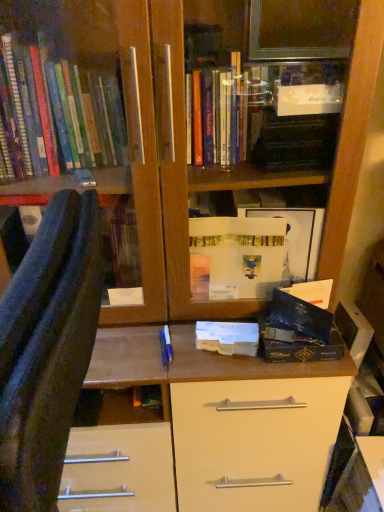
Question: Can you confirm if blue fabric chair at left is smaller than white matte paper at center?

Choices:
 (A) no
 (B) yes

Answer: (A)

Question: Does blue fabric chair at left have a lesser height compared to white matte paper at center?

Choices:
 (A) no
 (B) yes

Answer: (A)

Question: Considering the relative sizes of blue fabric chair at left and white matte paper at center in the image provided, is blue fabric chair at left bigger than white matte paper at center?

Choices:
 (A) no
 (B) yes

Answer: (B)

Question: Is blue fabric chair at left positioned before white matte paper at center?

Choices:
 (A) no
 (B) yes

Answer: (B)

Question: Would you say blue fabric chair at left is outside white matte paper at center?

Choices:
 (A) no
 (B) yes

Answer: (B)

Question: Does blue fabric chair at left have a lesser width compared to white matte paper at center?

Choices:
 (A) yes
 (B) no

Answer: (B)

Question: Is white matte paper at center beside blue fabric chair at left?

Choices:
 (A) no
 (B) yes

Answer: (A)

Question: Considering the relative sizes of white matte paper at center and blue fabric chair at left in the image provided, is white matte paper at center smaller than blue fabric chair at left?

Choices:
 (A) yes
 (B) no

Answer: (A)

Question: Is white matte paper at center surrounding blue fabric chair at left?

Choices:
 (A) yes
 (B) no

Answer: (B)

Question: Is white matte paper at center taller than blue fabric chair at left?

Choices:
 (A) no
 (B) yes

Answer: (A)

Question: Does white matte paper at center lie behind blue fabric chair at left?

Choices:
 (A) yes
 (B) no

Answer: (A)

Question: Does white matte paper at center appear on the right side of blue fabric chair at left?

Choices:
 (A) no
 (B) yes

Answer: (B)

Question: Is point (89, 240) closer or farther from the camera than point (236, 322)?

Choices:
 (A) closer
 (B) farther

Answer: (A)